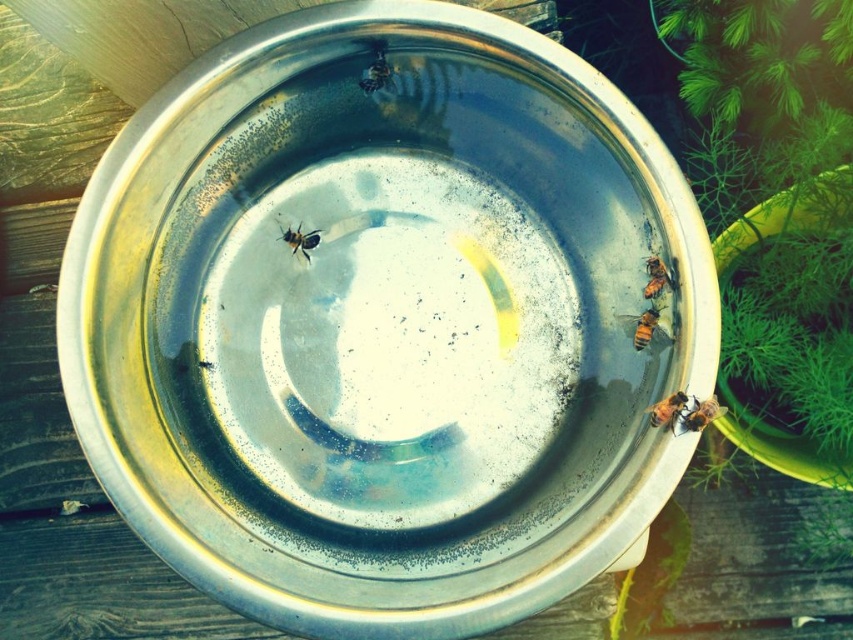
Who is positioned more to the left, translucent yellowish honeybee at bottom right or translucent yellowish honeybee at center?

translucent yellowish honeybee at center

Locate an element on the screen. The width and height of the screenshot is (853, 640). translucent yellowish honeybee at bottom right is located at coordinates (666, 410).

Does translucent orange bee at right have a greater width compared to shiny metallic bee at center?

No.

I want to click on translucent orange bee at right, so click(659, 276).

Who is more forward, (657, 326) or (706, 397)?

Point (706, 397) is in front.

Can you confirm if translucent yellowish honeybee at right is positioned below translucent yellowish honeybee at lower right?

Actually, translucent yellowish honeybee at right is above translucent yellowish honeybee at lower right.

Where is `translucent yellowish honeybee at right`? This screenshot has height=640, width=853. translucent yellowish honeybee at right is located at coordinates [x=645, y=328].